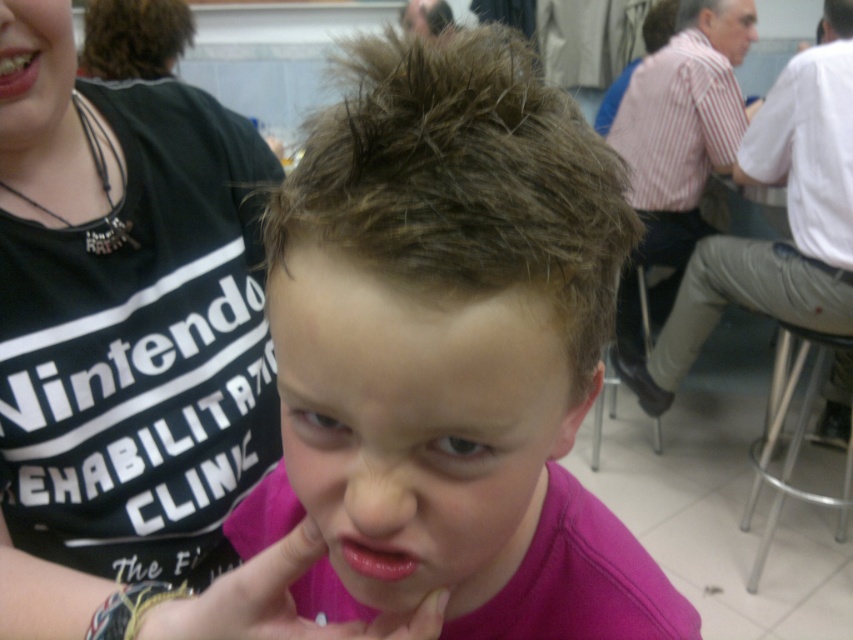
Is pink matte skin at center shorter than pink matte hand at lower center?

Incorrect, pink matte skin at center's height does not fall short of pink matte hand at lower center's.

The width and height of the screenshot is (853, 640). What do you see at coordinates (418, 420) in the screenshot?
I see `pink matte skin at center` at bounding box center [418, 420].

Identify the location of pink matte skin at center. The width and height of the screenshot is (853, 640). (418, 420).

Who is positioned more to the left, pink matte hair at center or matte black shirt at upper center?

Positioned to the left is pink matte hair at center.

This screenshot has width=853, height=640. What do you see at coordinates (451, 349) in the screenshot? I see `pink matte hair at center` at bounding box center [451, 349].

Does point (515, 564) come in front of point (730, 52)?

Yes, point (515, 564) is in front of point (730, 52).

Find the location of a particular element. pink matte hair at center is located at coordinates (451, 349).

Is point (370, 314) positioned before point (843, 531)?

Yes, it is in front of point (843, 531).

Is point (331, 556) more distant than point (790, 340)?

That is False.

I want to click on pink matte hair at center, so click(451, 349).